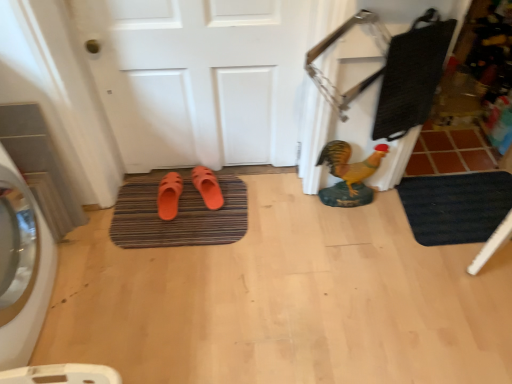
Find the location of `free region under black rubber bath mat at lower right, which is counted as the second bath mat, starting from the left (from a real-world perspective)`. free region under black rubber bath mat at lower right, which is counted as the second bath mat, starting from the left (from a real-world perspective) is located at coordinates (460, 208).